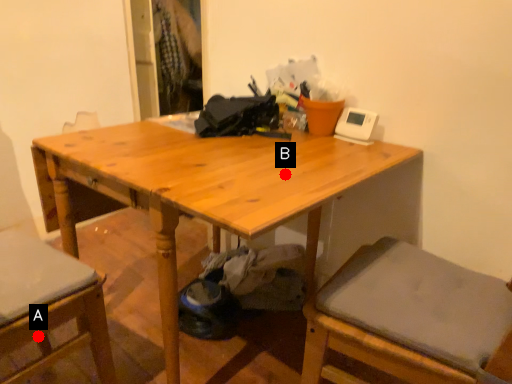
Question: Two points are circled on the image, labeled by A and B beside each circle. Which point is further to the camera?

Choices:
 (A) A is further
 (B) B is further

Answer: (A)